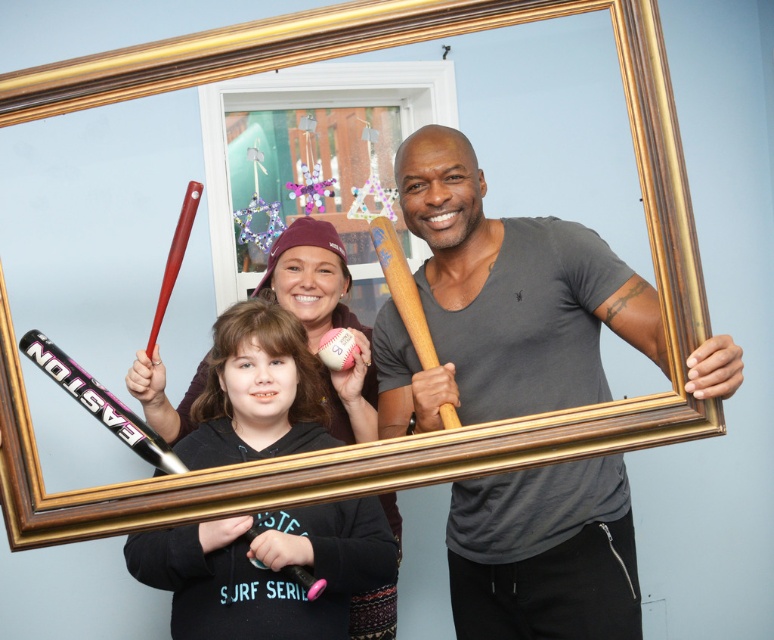
You are a photographer setting up for a group photo. You have two baseball bats available for props. The pink matte baseball bat at center and the matte red baseball bat at upper left. Which bat should you choose if you want a wider prop for the photo?

The pink matte baseball bat at center might be wider than matte red baseball bat at upper left, so you should choose the pink matte baseball bat at center for a wider prop.

You are standing in the room where the photo was taken and want to place a small sticker on the point closer to you between point (213, 548) and point (189, 189). Which point should you choose?

You should choose point (213, 548) because it is closer to the viewer than point (189, 189).